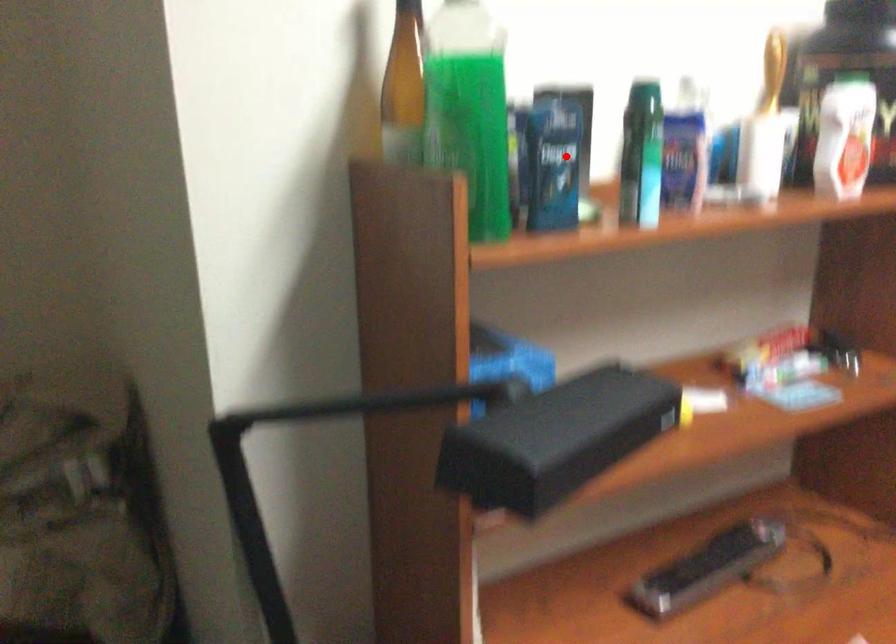
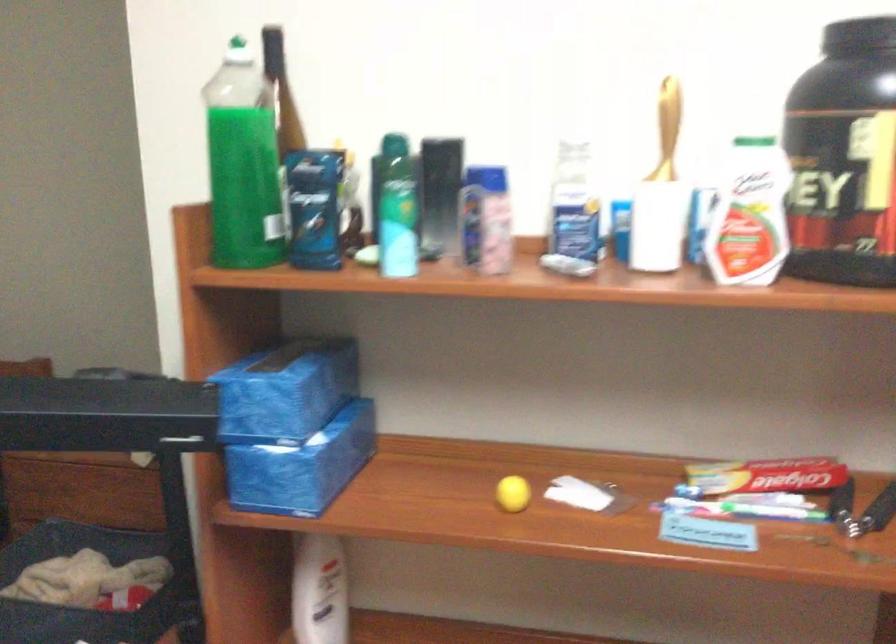
In the second image, find the point that corresponds to the highlighted location in the first image.

(314, 207)